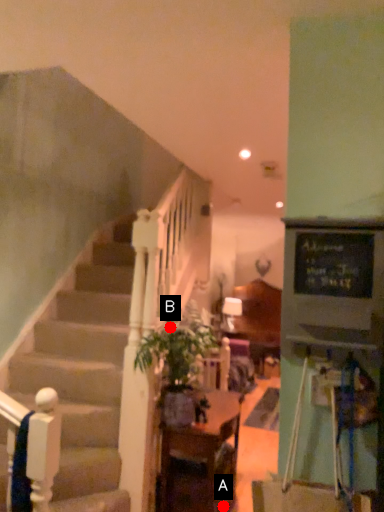
Question: Two points are circled on the image, labeled by A and B beside each circle. Which point is closer to the camera taking this photo?

Choices:
 (A) A is closer
 (B) B is closer

Answer: (B)